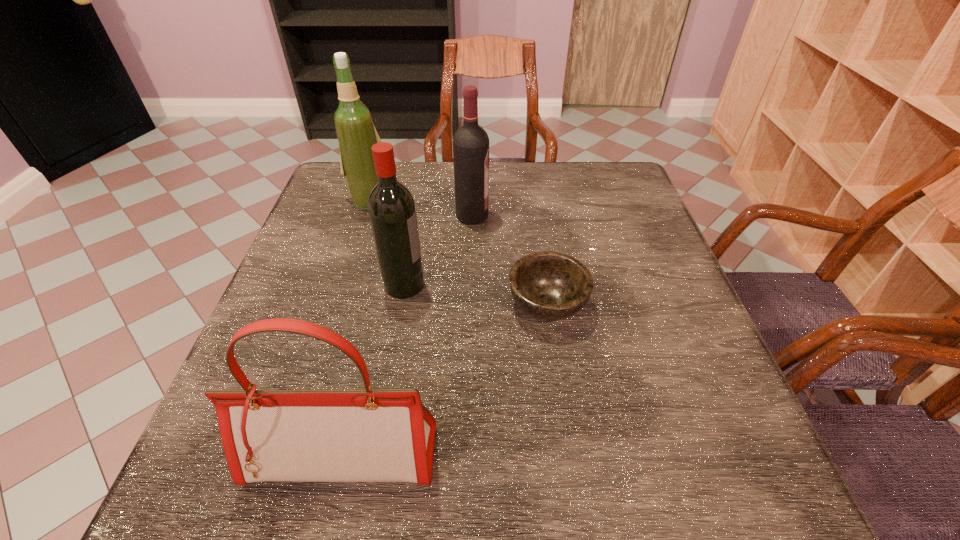
Where is `vacant space situated on the front of the shortest object`? This screenshot has width=960, height=540. vacant space situated on the front of the shortest object is located at coordinates (563, 410).

Find the location of `object present at the near edge`. object present at the near edge is located at coordinates coord(366,435).

Locate an element on the screen. wine bottle situated at the left edge is located at coordinates (356, 133).

Where is `handbag that is at the left edge`? handbag that is at the left edge is located at coordinates (366, 435).

I want to click on object situated at the far left corner, so click(356, 133).

Locate an element on the screen. This screenshot has height=540, width=960. object that is at the near left corner is located at coordinates (366, 435).

Image resolution: width=960 pixels, height=540 pixels. In the image, there is a desktop. Identify the location of free space at the far edge. (415, 170).

Where is `free space at the near edge of the desktop`? The image size is (960, 540). free space at the near edge of the desktop is located at coordinates (443, 462).

Where is `free space at the left edge`? free space at the left edge is located at coordinates (261, 351).

This screenshot has width=960, height=540. In the image, there is a desktop. Find the location of `vacant space at the right edge`. vacant space at the right edge is located at coordinates (661, 450).